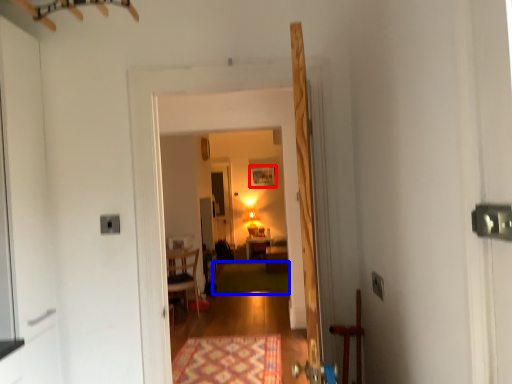
Question: Among these objects, which one is nearest to the camera, painting (highlighted by a red box) or mat (highlighted by a blue box)?

Choices:
 (A) painting
 (B) mat

Answer: (B)